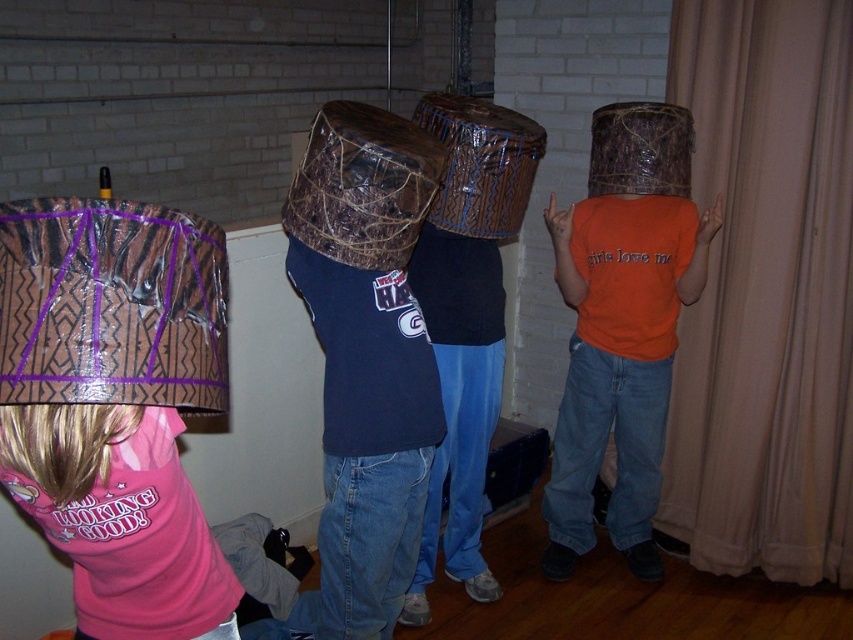
How much distance is there between matte brown drum at left and orange matte t-shirt at center?

The distance of matte brown drum at left from orange matte t-shirt at center is 5.96 feet.

Who is taller, matte brown drum at left or orange matte t-shirt at center?

With more height is orange matte t-shirt at center.

Is point (96, 317) closer to viewer compared to point (602, 368)?

Yes, it is in front of point (602, 368).

Where is `matte brown drum at left`? The image size is (853, 640). matte brown drum at left is located at coordinates (120, 397).

Which of these two, matte brown drum at left or brown woven basket at center, stands taller?

matte brown drum at left is taller.

Can you confirm if matte brown drum at left is bigger than brown woven basket at center?

Yes.

Is point (195, 556) positioned before point (408, 237)?

Yes, it is.

Locate an element on the screen. The height and width of the screenshot is (640, 853). matte brown drum at left is located at coordinates (120, 397).

Which of these two, matte brown drum at left or brown textured basket at center, stands taller?

matte brown drum at left is taller.

Which is behind, point (161, 572) or point (445, 204)?

The point (445, 204) is behind.

Between point (32, 243) and point (491, 156), which one is positioned behind?

The point (491, 156) is behind.

The width and height of the screenshot is (853, 640). Identify the location of matte brown drum at left. (120, 397).